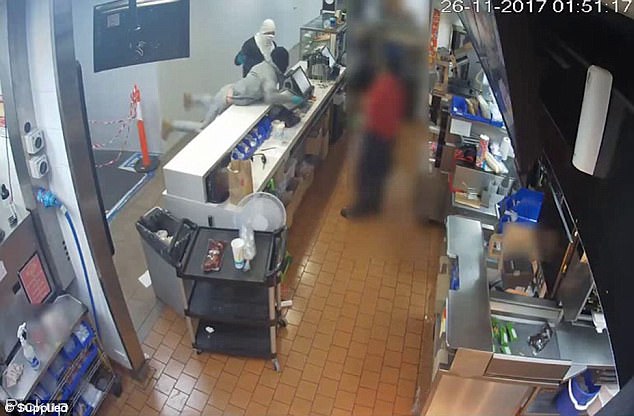
Identify the location of trash can. (150, 228).